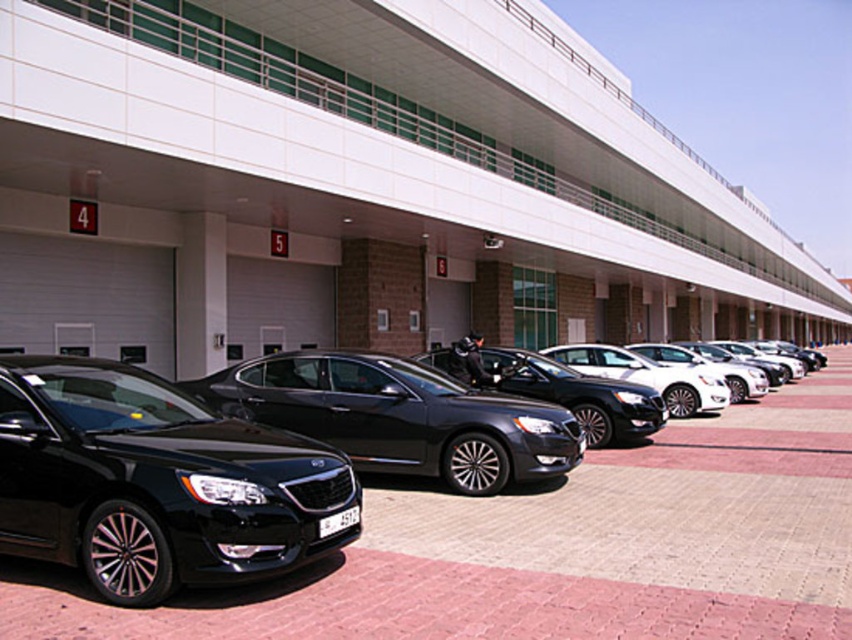
Question: Does glossy black sedan at center lie behind white glossy sedan at center?

Choices:
 (A) yes
 (B) no

Answer: (B)

Question: Does black metallic sedan at center have a smaller size compared to glossy black sedan at center?

Choices:
 (A) no
 (B) yes

Answer: (B)

Question: Among these points, which one is nearest to the camera?

Choices:
 (A) (556, 364)
 (B) (383, 422)
 (C) (611, 346)

Answer: (B)

Question: Which object is the closest to the black glossy car at center?

Choices:
 (A) black metallic sedan at center
 (B) shiny black sedan at center
 (C) white glossy sedan at center

Answer: (B)

Question: Based on their relative distances, which object is farther from the black metallic sedan at center?

Choices:
 (A) sleek black sedan at center
 (B) glossy black sedan at center
 (C) white glossy sedan at center

Answer: (C)

Question: Is black glossy car at center positioned in front of sleek black sedan at center?

Choices:
 (A) no
 (B) yes

Answer: (B)